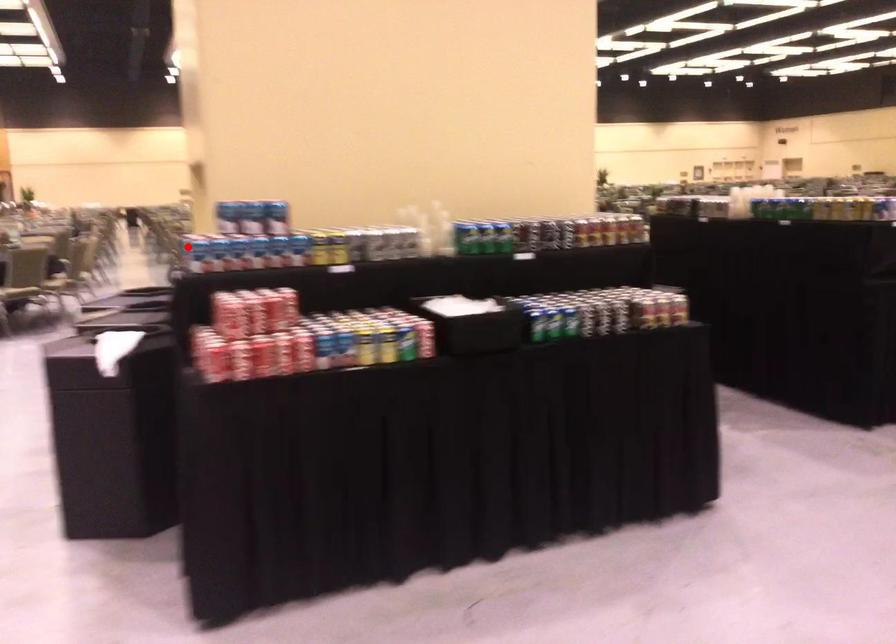
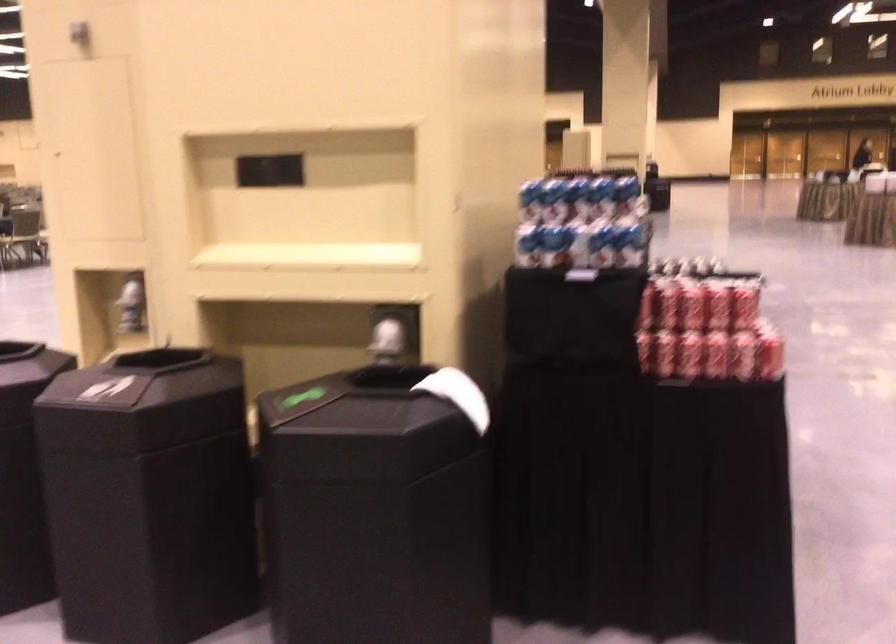
Find the pixel in the second image that matches the highlighted location in the first image.

(528, 245)